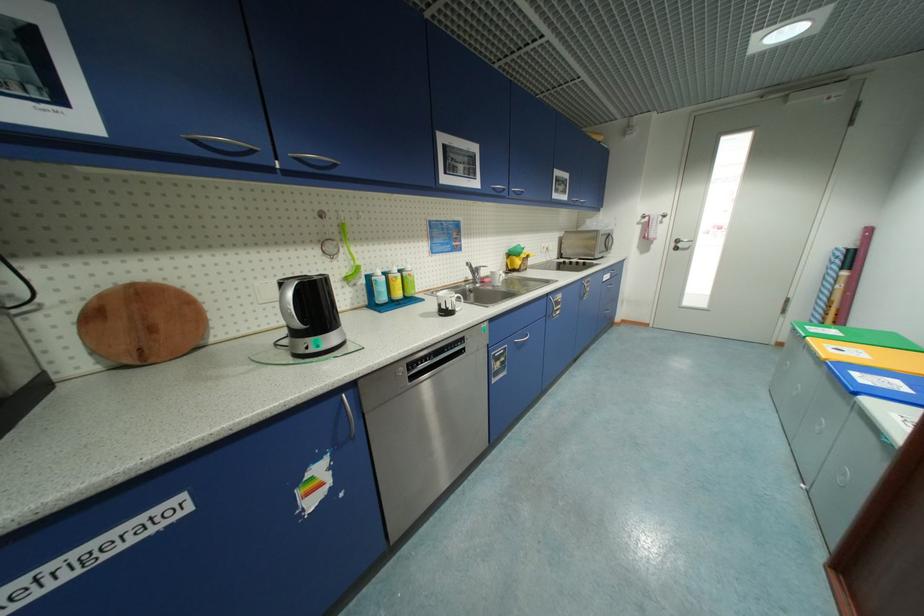
What do you see at coordinates (825, 330) in the screenshot? The image size is (924, 616). I see `the green bin lid` at bounding box center [825, 330].